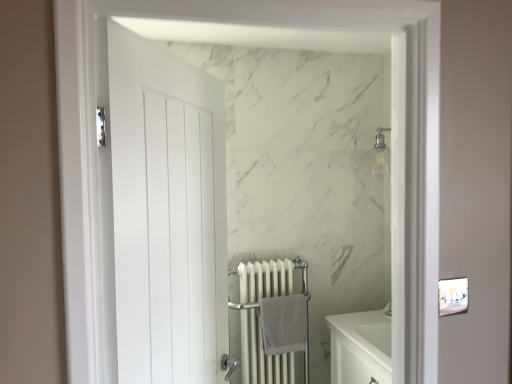
What do you see at coordinates (284, 323) in the screenshot? I see `gray cotton bath towel at center` at bounding box center [284, 323].

Image resolution: width=512 pixels, height=384 pixels. Describe the element at coordinates (259, 318) in the screenshot. I see `white metal radiator at center` at that location.

You are a GUI agent. You are given a task and a screenshot of the screen. Output one action in this format:
    pyautogui.click(x=<x>, y=<y>)
    Task: Click on the gray cotton bath towel at center
    The height and width of the screenshot is (384, 512).
    Given the screenshot: What is the action you would take?
    pyautogui.click(x=284, y=323)

Is white metal radiator at center facing away from white matte door at left?

white metal radiator at center does not have its back to white matte door at left.

Where is `radiator located underneath the white matte door at left (from a real-world perspective)`? The height and width of the screenshot is (384, 512). radiator located underneath the white matte door at left (from a real-world perspective) is located at coordinates (259, 318).

Considering the sizes of objects white metal radiator at center and white matte door at left in the image provided, who is shorter, white metal radiator at center or white matte door at left?

With less height is white metal radiator at center.

Is point (98, 84) positioned in front of point (264, 349)?

Yes, point (98, 84) is in front of point (264, 349).

From a real-world perspective, is white matte door at left positioned above or below gray cotton bath towel at center?

white matte door at left is above gray cotton bath towel at center.

Measure the distance from white matte door at left to gray cotton bath towel at center.

white matte door at left and gray cotton bath towel at center are 1.13 meters apart from each other.

Can you confirm if white matte door at left is smaller than gray cotton bath towel at center?

Incorrect, white matte door at left is not smaller in size than gray cotton bath towel at center.

Between gray cotton bath towel at center and white metal radiator at center, which one appears on the left side from the viewer's perspective?

Positioned to the left is white metal radiator at center.

Is gray cotton bath towel at center positioned with its back to white metal radiator at center?

Absolutely, gray cotton bath towel at center is directed away from white metal radiator at center.

From a real-world perspective, does gray cotton bath towel at center stand above white metal radiator at center?

Indeed, from a real-world perspective, gray cotton bath towel at center stands above white metal radiator at center.

In the image, is gray cotton bath towel at center positioned in front of or behind white metal radiator at center?

Clearly, gray cotton bath towel at center is behind white metal radiator at center.

In the scene shown: Which is correct: white matte door at left is inside white metal radiator at center, or outside of it?

white matte door at left is not inside white metal radiator at center, it's outside.

Considering the relative positions of white matte door at left and white metal radiator at center in the image provided, is white matte door at left to the right of white metal radiator at center from the viewer's perspective?

Incorrect, white matte door at left is not on the right side of white metal radiator at center.

From a real-world perspective, does white matte door at left stand above white metal radiator at center?

Correct, in the physical world, white matte door at left is higher than white metal radiator at center.

From the image's perspective, between white matte door at left and white metal radiator at center, who is located below?

white metal radiator at center is shown below in the image.

Is gray cotton bath towel at center in front of or behind white matte door at left in the image?

Visually, gray cotton bath towel at center is located behind white matte door at left.

Looking at the image, does gray cotton bath towel at center seem bigger or smaller compared to white matte door at left?

gray cotton bath towel at center is smaller than white matte door at left.

From a real-world perspective, is gray cotton bath towel at center above or below white matte door at left?

Clearly, from a real-world perspective, gray cotton bath towel at center is below white matte door at left.

Is gray cotton bath towel at center completely or partially outside of white matte door at left?

That's correct, gray cotton bath towel at center is outside of white matte door at left.

From the image's perspective, which is below, white metal radiator at center or gray cotton bath towel at center?

white metal radiator at center appears lower in the image.

Is white metal radiator at center turned away from gray cotton bath towel at center?

Yes, gray cotton bath towel at center is at the back of white metal radiator at center.

Who is more distant, white metal radiator at center or gray cotton bath towel at center?

Positioned behind is gray cotton bath towel at center.

Locate an element on the screen. The image size is (512, 384). door above the white metal radiator at center (from the image's perspective) is located at coordinates (166, 213).

At what (x,y) coordinates should I click in order to perform the action: click on bath towel on the right of white matte door at left. Please return your answer as a coordinate pair (x, y). This screenshot has width=512, height=384. Looking at the image, I should click on (284, 323).

From the image, which object appears to be farther from white metal radiator at center, gray cotton bath towel at center or white matte door at left?

white matte door at left lies further to white metal radiator at center than the other object.

Consider the image. Estimate the real-world distances between objects in this image. Which object is further from gray cotton bath towel at center, white metal radiator at center or white matte door at left?

white matte door at left is further to gray cotton bath towel at center.

When comparing their distances from white metal radiator at center, does white matte door at left or gray cotton bath towel at center seem further?

Among the two, white matte door at left is located further to white metal radiator at center.

Which object lies further to the anchor point white matte door at left, gray cotton bath towel at center or white metal radiator at center?

The object further to white matte door at left is white metal radiator at center.

Consider the image. Looking at the image, which one is located closer to gray cotton bath towel at center, white matte door at left or white metal radiator at center?

The object closer to gray cotton bath towel at center is white metal radiator at center.

Looking at the image, which one is located closer to white matte door at left, white metal radiator at center or gray cotton bath towel at center?

gray cotton bath towel at center is closer to white matte door at left.

In order to click on radiator positioned between white matte door at left and gray cotton bath towel at center from near to far in this screenshot , I will do `click(259, 318)`.